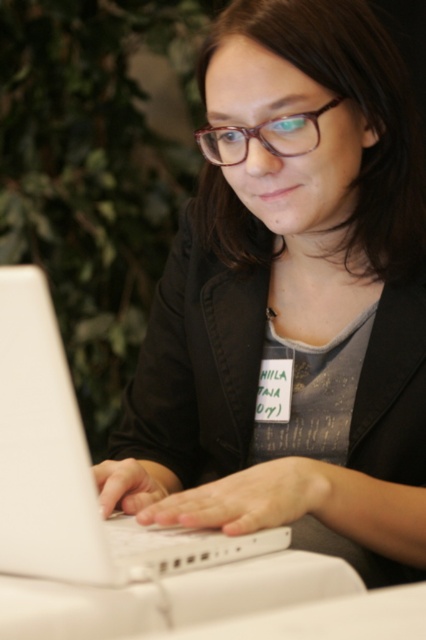
You are organizing a desk space and need to place the white matte laptop at center and the transparent plastic glasses at center side by side. Based on their sizes, which object should be placed first to ensure they fit properly?

The white matte laptop at center should be placed first since its width is greater than the transparent plastic glasses at center, ensuring there is enough space for both items.

You are a photographer taking a photo of the person seated at the table. The camera you are using has a focus point at coordinates 0.5, 0.5. Will the white matte laptop at center be in focus?

The white matte laptop at center is located at coordinates (74, 468), which is outside the camera focus point at (213, 320). Therefore, it will not be in focus.

You are a photographer taking a closeup shot of the white matte laptop at center and the transparent plastic glasses at center. Which object is closer to the camera lens?

The transparent plastic glasses at center are closer to the camera lens because the white matte laptop at center is positioned under them, meaning the glasses are in front of the laptop in the frame.